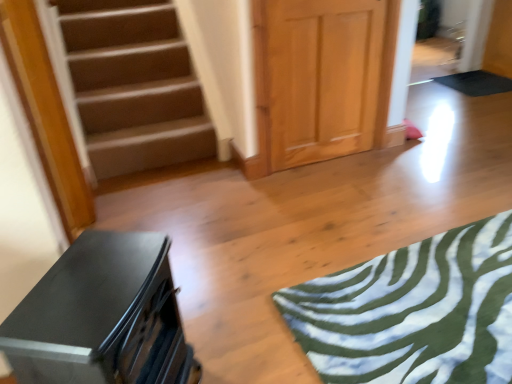
Where is `free area behind green fabric yoga mat at lower right, arranged as the 1th yoga mat when viewed from the left`? free area behind green fabric yoga mat at lower right, arranged as the 1th yoga mat when viewed from the left is located at coordinates (392, 191).